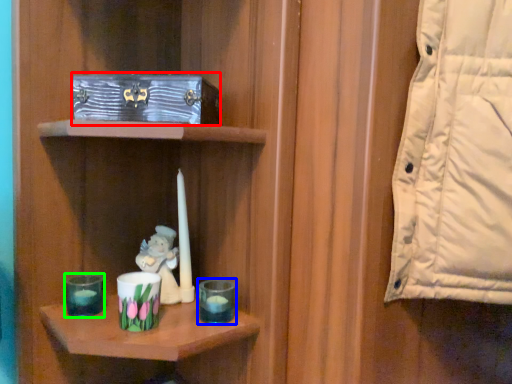
Question: Considering the real-world distances, which object is closest to box (highlighted by a red box)? candle holder (highlighted by a blue box) or candle holder (highlighted by a green box).

Choices:
 (A) candle holder
 (B) candle holder

Answer: (A)